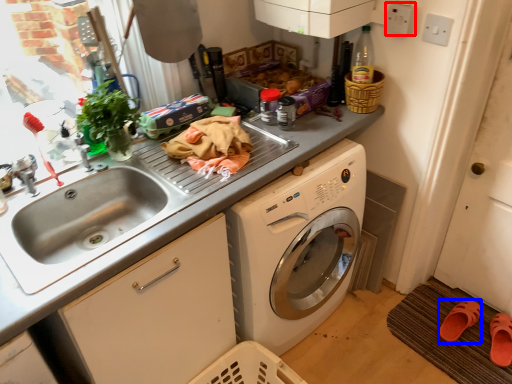
Question: Which object is closer to the camera taking this photo, electric outlet (highlighted by a red box) or shoe (highlighted by a blue box)?

Choices:
 (A) electric outlet
 (B) shoe

Answer: (A)